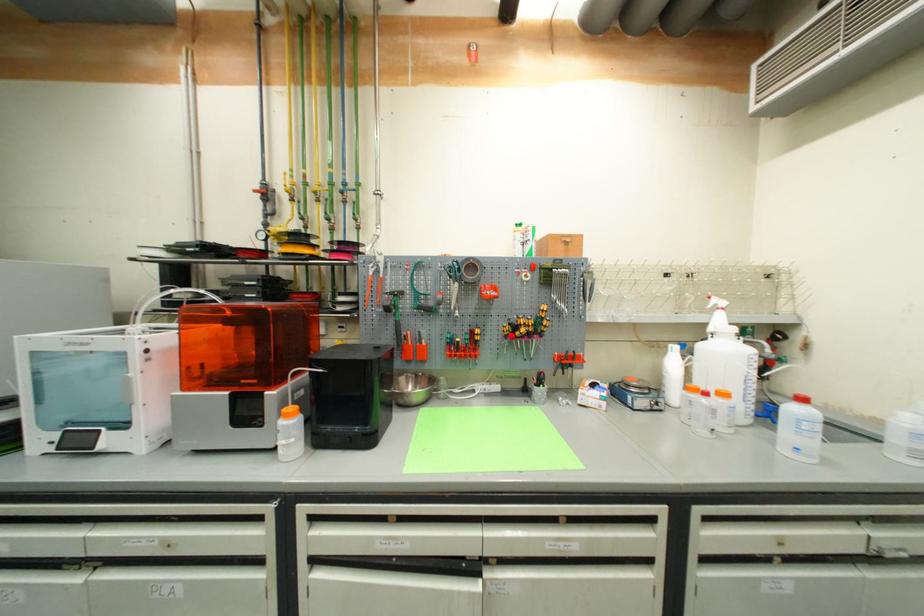
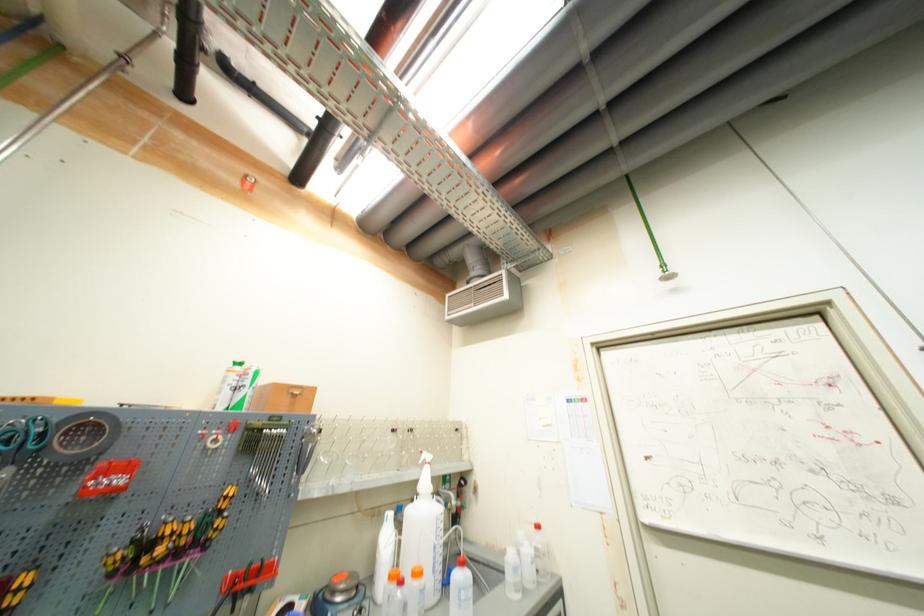
Question: I am providing you with two images of the same scene from different viewpoints. In image1, a red point is highlighted. Considering the same 3D point in image2, which of the following is correct?

Choices:
 (A) It is closer
 (B) It is farther

Answer: (A)